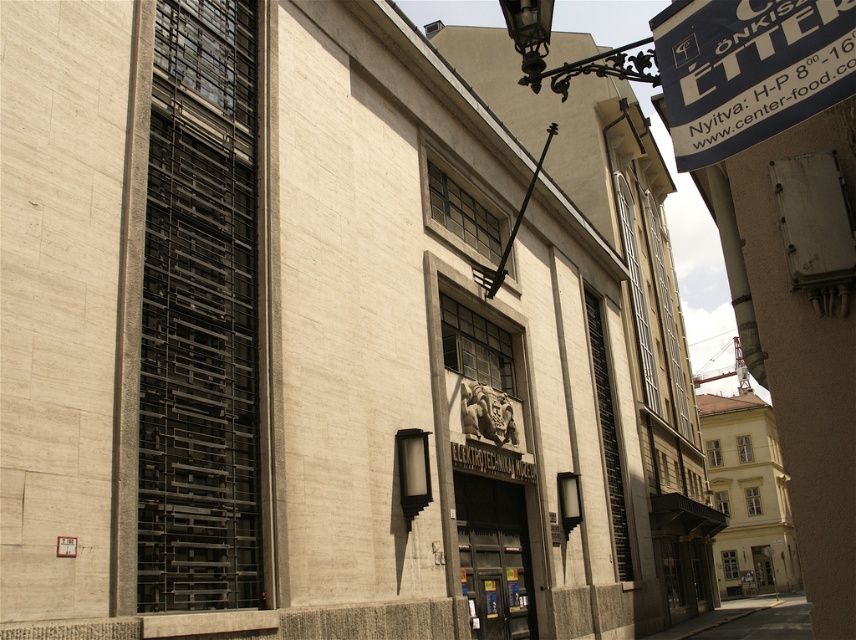
You are standing at the entrance of the ELEKTROTECHNISCHES MUSEUM and want to locate the blue fabric sign at upper right and the dark gray concrete alley at lower right. From your perspective, which object is positioned more to the right?

The dark gray concrete alley at lower right is positioned more to the right because the blue fabric sign at upper right is to the left of it.

You are standing in front of the building shown in the image. You want to locate the blue fabric sign at upper right. Where should you look relative to the entrance?

The blue fabric sign at upper right is located at the upper right area of the image, which is to the right and above the entrance.

You are standing in front of the building and want to locate the two points marked on the facade. Which point is closer to you, the point at coordinates point (841, 12) or point (789, 634)?

Point (841, 12) is in front of point (789, 634), so the point at coordinates point (841, 12) is closer to you.